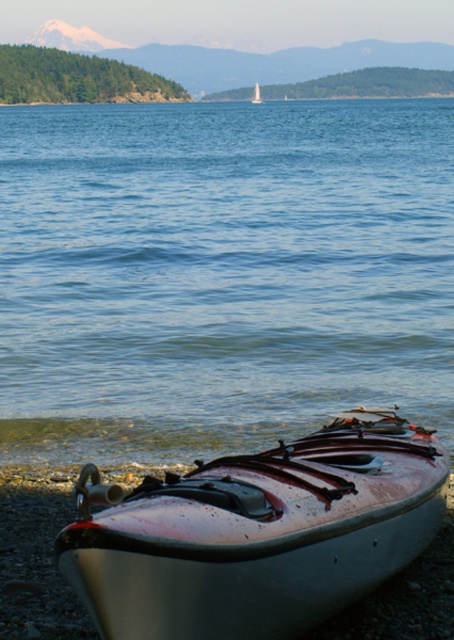
Question: Which is farther from the blue water at lower center?

Choices:
 (A) white glossy kayak at lower center
 (B) silver metallic kayak at lower center

Answer: (A)

Question: Does blue water at lower center have a greater width compared to silver metallic kayak at lower center?

Choices:
 (A) yes
 (B) no

Answer: (A)

Question: Does blue water at lower center have a greater width compared to white glossy kayak at lower center?

Choices:
 (A) no
 (B) yes

Answer: (B)

Question: Observing the image, what is the correct spatial positioning of blue water at lower center in reference to silver metallic kayak at lower center?

Choices:
 (A) below
 (B) above

Answer: (B)

Question: Which point is closer to the camera taking this photo?

Choices:
 (A) (90, 528)
 (B) (258, 93)
 (C) (79, 259)

Answer: (A)

Question: Among these points, which one is farthest from the camera?

Choices:
 (A) (360, 257)
 (B) (261, 99)

Answer: (B)